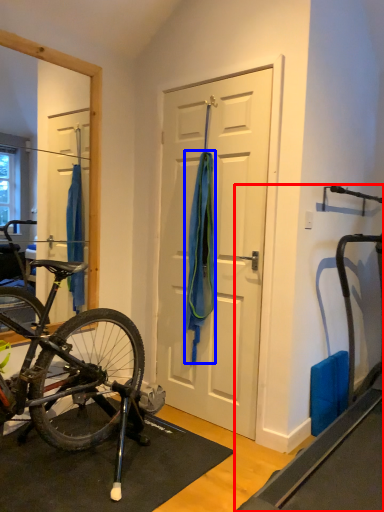
Question: Which object appears farthest to the camera in this image, treadmill (highlighted by a red box) or towel/napkin (highlighted by a blue box)?

Choices:
 (A) treadmill
 (B) towel/napkin

Answer: (B)